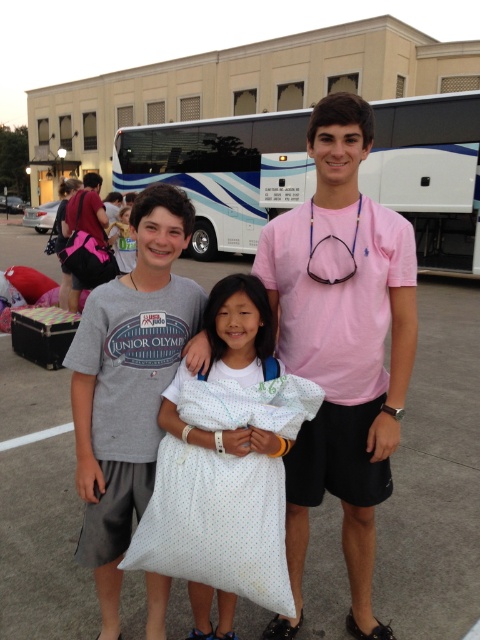
You are standing at the center of the parking lot and want to take a photo of the white glossy bus at upper center. In which direction should you walk to reach it?

The white glossy bus at upper center is located at point [223,172], so you should walk towards the upper center direction to reach it.

You are a photographer trying to capture a photo of the white glossy bus at upper center and the matte pink backpack at center. Based on their positions, which object should you focus on first to ensure both are in the frame?

The matte pink backpack at center should be focused on first since the white glossy bus at upper center is located above it, allowing you to adjust the framing to include both.